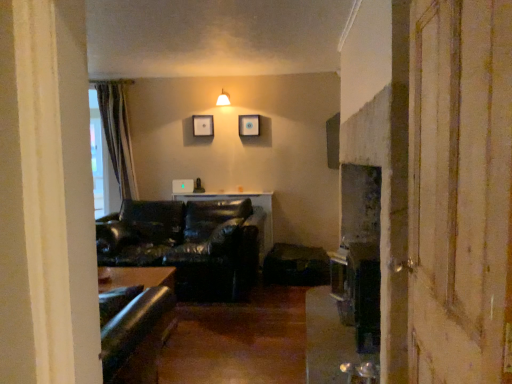
Question: From the image's perspective, does matte white lampshade at upper center appear higher than matte black picture frame at upper center, the 1th picture frame from the left?

Choices:
 (A) yes
 (B) no

Answer: (A)

Question: Is matte black picture frame at upper center, the 1th picture frame from the left, located within matte white lampshade at upper center?

Choices:
 (A) yes
 (B) no

Answer: (B)

Question: Considering the relative sizes of matte white lampshade at upper center and matte black picture frame at upper center, the 1th picture frame from the left, in the image provided, is matte white lampshade at upper center thinner than matte black picture frame at upper center, the 1th picture frame from the left,?

Choices:
 (A) no
 (B) yes

Answer: (A)

Question: Is matte white lampshade at upper center closer to the viewer compared to matte black picture frame at upper center, which ranks as the second picture frame in right-to-left order?

Choices:
 (A) no
 (B) yes

Answer: (B)

Question: Is matte white lampshade at upper center taller than matte black picture frame at upper center, the 1th picture frame from the left?

Choices:
 (A) yes
 (B) no

Answer: (B)

Question: Would you say wooden screen door at right is inside or outside matte black picture frame at upper center, which ranks as the second picture frame in right-to-left order?

Choices:
 (A) inside
 (B) outside

Answer: (B)

Question: From the image's perspective, is wooden screen door at right located above or below matte black picture frame at upper center, which ranks as the second picture frame in right-to-left order?

Choices:
 (A) above
 (B) below

Answer: (B)

Question: Considering the relative positions of wooden screen door at right and matte black picture frame at upper center, the 1th picture frame from the left, in the image provided, is wooden screen door at right to the left or to the right of matte black picture frame at upper center, the 1th picture frame from the left,?

Choices:
 (A) right
 (B) left

Answer: (A)

Question: Does point coord(446,74) appear closer or farther from the camera than point coord(202,135)?

Choices:
 (A) farther
 (B) closer

Answer: (B)

Question: From the image's perspective, is wooden picture frame at upper center, arranged as the 2th picture frame when viewed from the left, positioned above or below matte black picture frame at upper center, which ranks as the second picture frame in right-to-left order?

Choices:
 (A) above
 (B) below

Answer: (B)

Question: From a real-world perspective, is wooden picture frame at upper center, arranged as the 2th picture frame when viewed from the left, above or below matte black picture frame at upper center, the 1th picture frame from the left?

Choices:
 (A) above
 (B) below

Answer: (B)

Question: Looking at their shapes, would you say wooden picture frame at upper center, which ranks as the 1th picture frame in right-to-left order, is wider or thinner than matte black picture frame at upper center, which ranks as the second picture frame in right-to-left order?

Choices:
 (A) wide
 (B) thin

Answer: (A)

Question: Considering the positions of point (257, 135) and point (207, 114), is point (257, 135) closer or farther from the camera than point (207, 114)?

Choices:
 (A) closer
 (B) farther

Answer: (A)

Question: Is matte black picture frame at upper center, the 1th picture frame from the left, bigger or smaller than matte white lampshade at upper center?

Choices:
 (A) big
 (B) small

Answer: (B)

Question: Considering the positions of matte black picture frame at upper center, which ranks as the second picture frame in right-to-left order, and matte white lampshade at upper center in the image, is matte black picture frame at upper center, which ranks as the second picture frame in right-to-left order, taller or shorter than matte white lampshade at upper center?

Choices:
 (A) tall
 (B) short

Answer: (A)